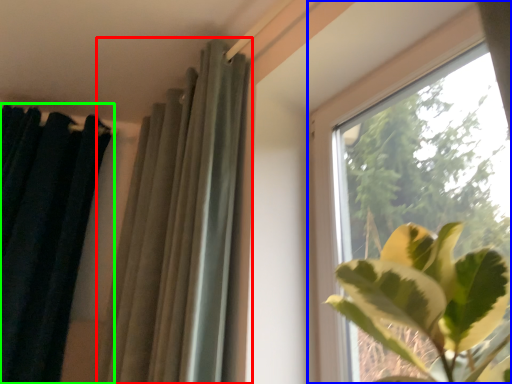
Question: Considering the real-world distances, which object is closest to curtain (highlighted by a red box)? window (highlighted by a blue box) or curtain (highlighted by a green box).

Choices:
 (A) window
 (B) curtain

Answer: (A)